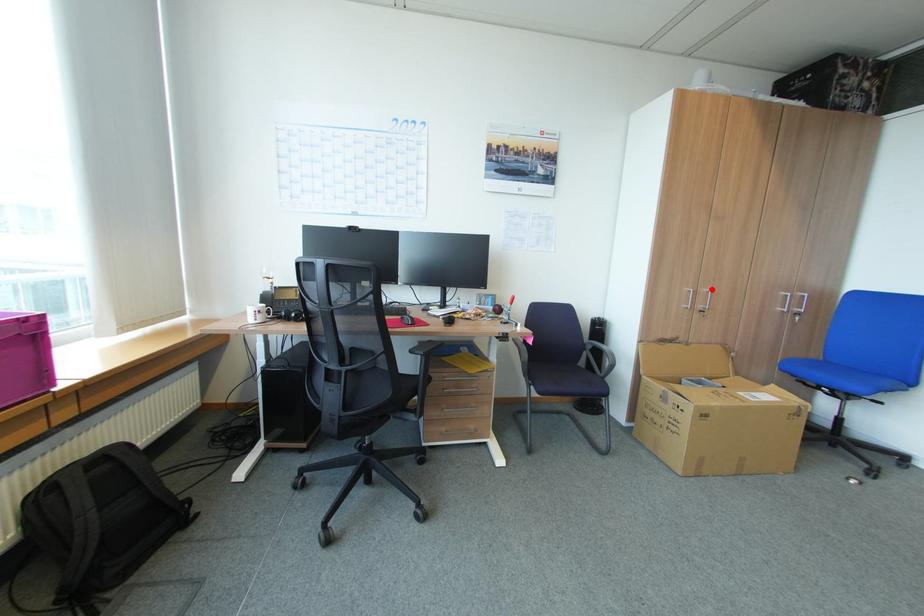
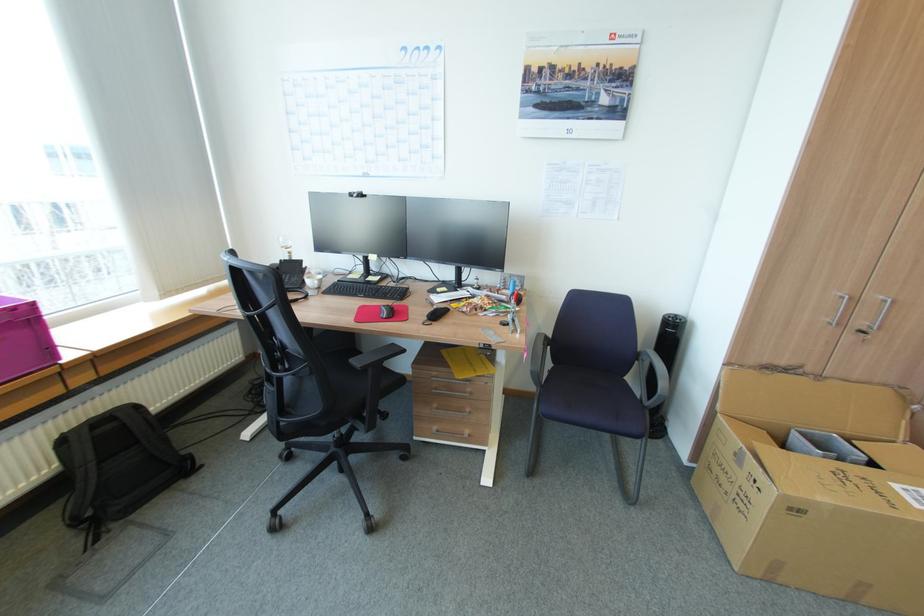
Where in the second image is the point corresponding to the highlighted location from the first image?

(888, 297)